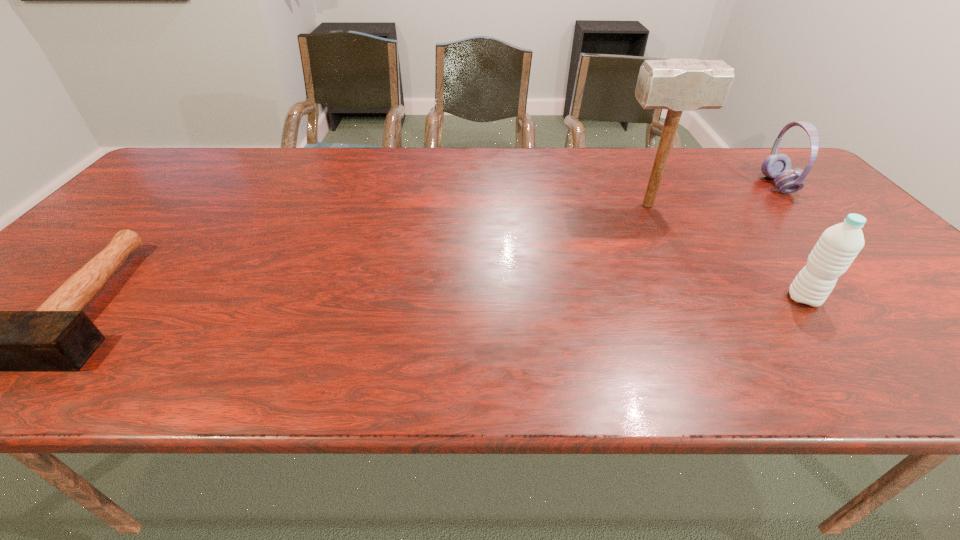
Locate an element on the screen. the second object from left to right is located at coordinates (677, 85).

Where is `the farther mallet`? The image size is (960, 540). the farther mallet is located at coordinates (677, 85).

Identify the location of the third object from left to right. (839, 245).

You are a GUI agent. You are given a task and a screenshot of the screen. Output one action in this format:
    pyautogui.click(x=<x>, y=<y>)
    Task: Click on the headset
    The image size is (960, 540).
    Given the screenshot: What is the action you would take?
    pyautogui.click(x=777, y=166)

You are a GUI agent. You are given a task and a screenshot of the screen. Output one action in this format:
    pyautogui.click(x=<x>, y=<y>)
    Task: Click on the vacant space located 0.160m on the striking face of the tallest object
    Image resolution: width=960 pixels, height=540 pixels.
    Given the screenshot: What is the action you would take?
    pyautogui.click(x=557, y=205)

Locate an element on the screen. free space located 0.190m on the striking face of the tallest object is located at coordinates (545, 205).

Find the location of a particular element. free spot located 0.060m on the striking face of the tallest object is located at coordinates (592, 205).

At what (x,y) coordinates should I click in order to perform the action: click on free space located on the back of the water bottle. Please return your answer as a coordinate pair (x, y). This screenshot has height=540, width=960. Looking at the image, I should click on (776, 262).

Where is `vacant space located 0.400m on the headband and ear cups of the headset`? The width and height of the screenshot is (960, 540). vacant space located 0.400m on the headband and ear cups of the headset is located at coordinates (630, 185).

This screenshot has height=540, width=960. What are the coordinates of `blank area located 0.050m on the headband and ear cups of the headset` in the screenshot? It's located at (748, 185).